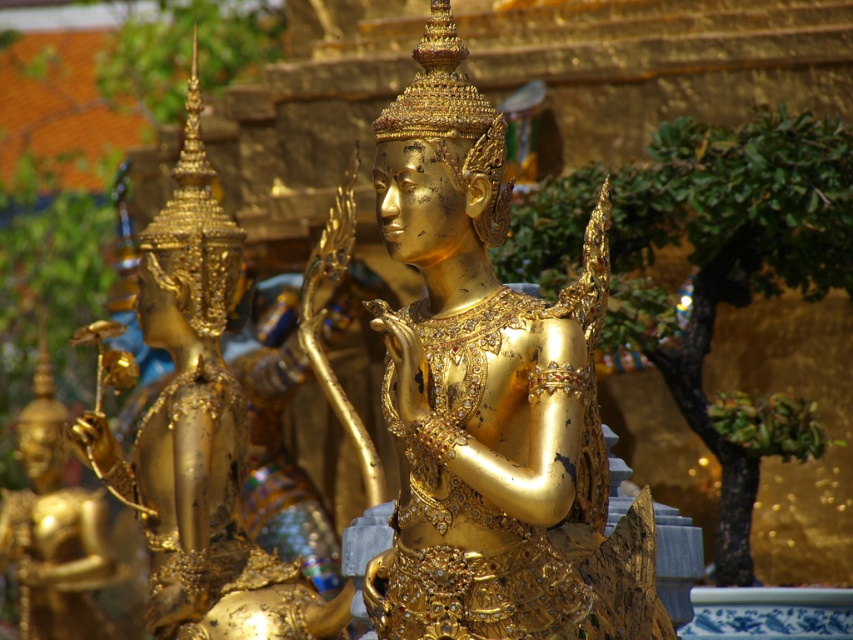
Between point (369, 576) and point (178, 360), which one is positioned behind?

Point (178, 360)

Can you confirm if shiny gold statue at center is positioned below gold polished statue at center?

No.

Between point (381, 193) and point (213, 557), which one is positioned in front?

Point (381, 193) is in front.

This screenshot has height=640, width=853. I want to click on shiny gold statue at center, so click(491, 397).